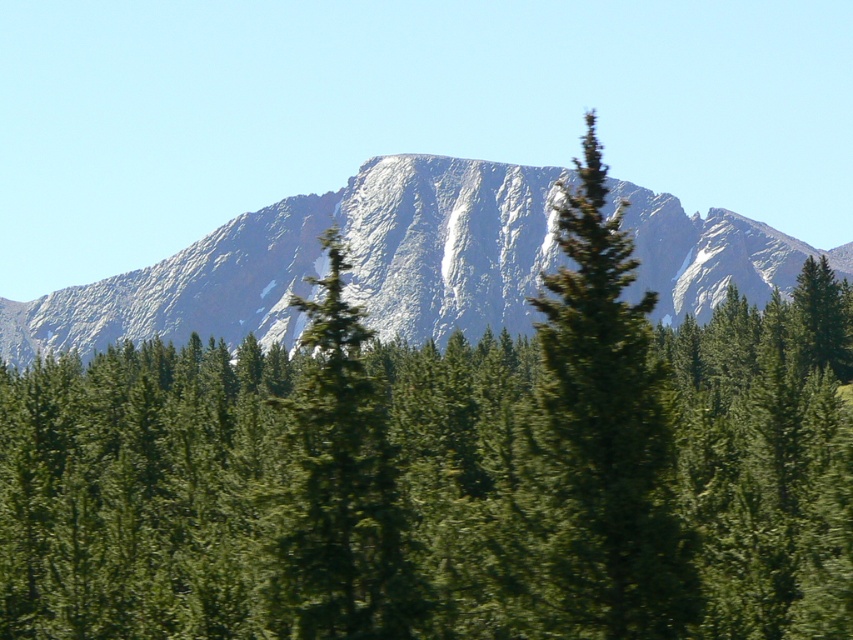
Question: Is green leafy trees at center to the left of green textured tree at center from the viewer's perspective?

Choices:
 (A) no
 (B) yes

Answer: (B)

Question: Is green leafy trees at center behind green matte tree at center?

Choices:
 (A) no
 (B) yes

Answer: (A)

Question: Considering the real-world distances, which object is closest to the gray rocky mountain at center?

Choices:
 (A) green textured tree at center
 (B) green leafy trees at center
 (C) green matte tree at center

Answer: (C)

Question: Which of the following is the farthest from the observer?

Choices:
 (A) (451, 257)
 (B) (585, 433)

Answer: (A)

Question: Is gray rocky mountain at center thinner than green textured tree at center?

Choices:
 (A) yes
 (B) no

Answer: (B)

Question: Which is farther from the green matte tree at center?

Choices:
 (A) green textured tree at center
 (B) green leafy trees at center
 (C) gray rocky mountain at center

Answer: (C)